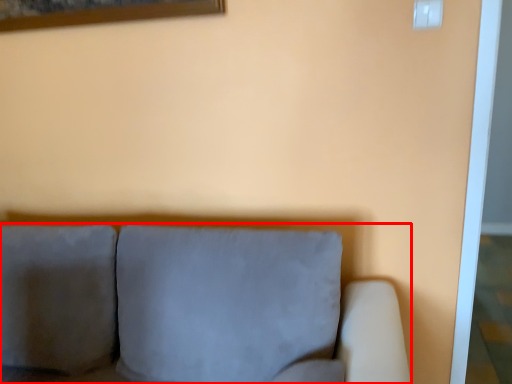
Question: From the image's perspective, where is studio couch (annotated by the red box) located relative to electric outlet?

Choices:
 (A) below
 (B) above

Answer: (A)